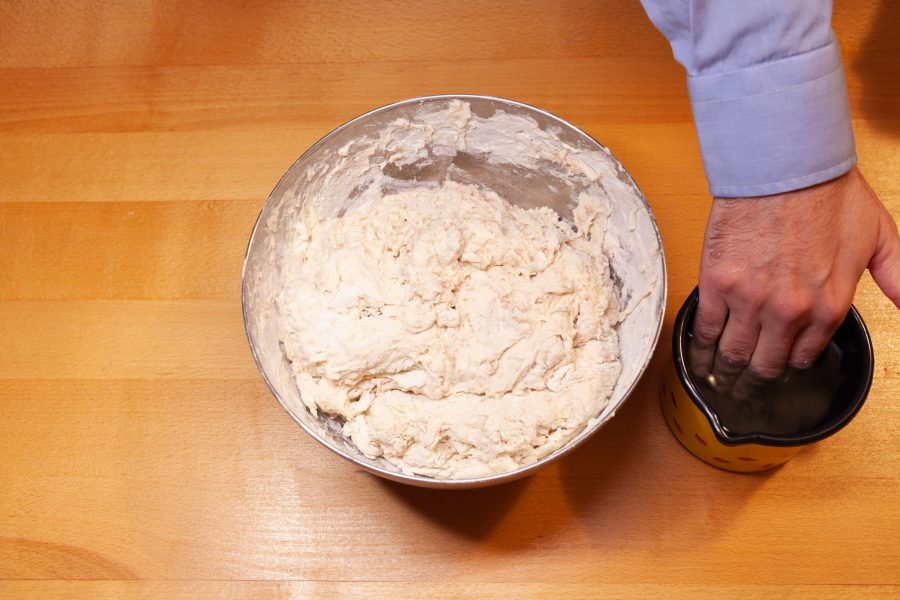
Identify the location of mug. (740, 457).